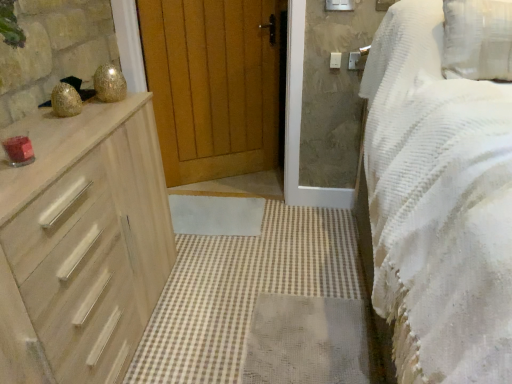
Question: From the image's perspective, does light wood chest of drawers at left appear higher than white textured bed at right?

Choices:
 (A) yes
 (B) no

Answer: (B)

Question: Does light wood chest of drawers at left have a greater width compared to white textured bed at right?

Choices:
 (A) yes
 (B) no

Answer: (B)

Question: Is light wood chest of drawers at left at the left side of white textured bed at right?

Choices:
 (A) no
 (B) yes

Answer: (B)

Question: Considering the relative positions of light wood chest of drawers at left and white textured bed at right in the image provided, is light wood chest of drawers at left behind white textured bed at right?

Choices:
 (A) no
 (B) yes

Answer: (B)

Question: Is light wood chest of drawers at left outside of white textured bed at right?

Choices:
 (A) yes
 (B) no

Answer: (A)

Question: Considering the positions of light wood chest of drawers at left and wooden at center in the image, is light wood chest of drawers at left bigger or smaller than wooden at center?

Choices:
 (A) small
 (B) big

Answer: (B)

Question: Is point coord(76,309) closer or farther from the camera than point coord(201,64)?

Choices:
 (A) closer
 (B) farther

Answer: (A)

Question: Is light wood chest of drawers at left wider or thinner than wooden at center?

Choices:
 (A) thin
 (B) wide

Answer: (B)

Question: Based on their positions, is light wood chest of drawers at left located to the left or right of wooden at center?

Choices:
 (A) left
 (B) right

Answer: (A)

Question: From a real-world perspective, is wooden at center positioned above or below white textured bed at right?

Choices:
 (A) above
 (B) below

Answer: (B)

Question: In the image, is wooden at center positioned in front of or behind white textured bed at right?

Choices:
 (A) behind
 (B) front

Answer: (A)

Question: Would you say wooden at center is to the left or to the right of white textured bed at right in the picture?

Choices:
 (A) left
 (B) right

Answer: (A)

Question: Would you say wooden at center is inside or outside white textured bed at right?

Choices:
 (A) inside
 (B) outside

Answer: (B)

Question: Relative to white plastic light switch at upper right, is white textured bed at right in front or behind?

Choices:
 (A) behind
 (B) front

Answer: (B)

Question: From a real-world perspective, is white textured bed at right above or below white plastic light switch at upper right?

Choices:
 (A) below
 (B) above

Answer: (A)